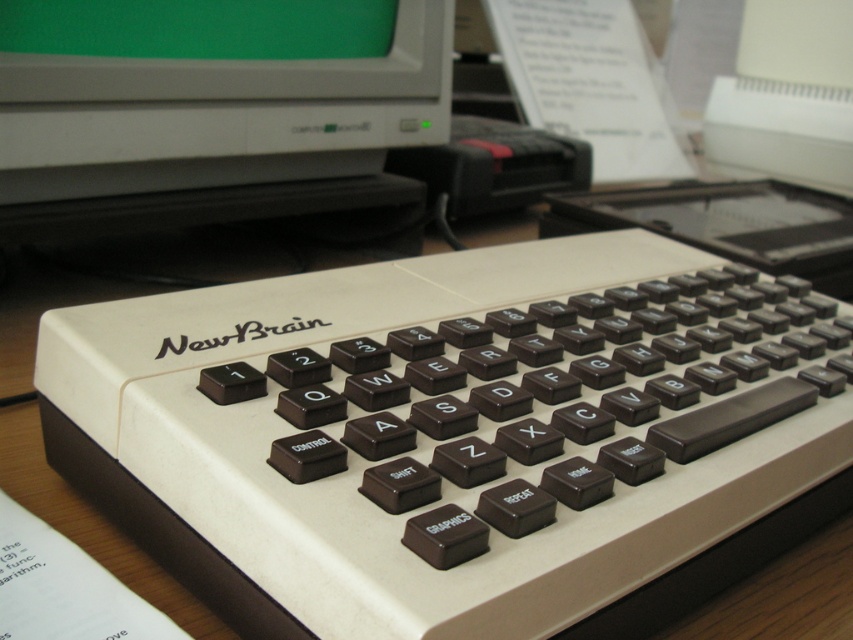
Can you confirm if green matte monitor at upper center is positioned to the right of white plastic keyboard at center?

Incorrect, green matte monitor at upper center is not on the right side of white plastic keyboard at center.

Between green matte monitor at upper center and white plastic keyboard at center, which one has more height?

white plastic keyboard at center is taller.

This screenshot has height=640, width=853. In order to click on green matte monitor at upper center in this screenshot , I will do `click(212, 92)`.